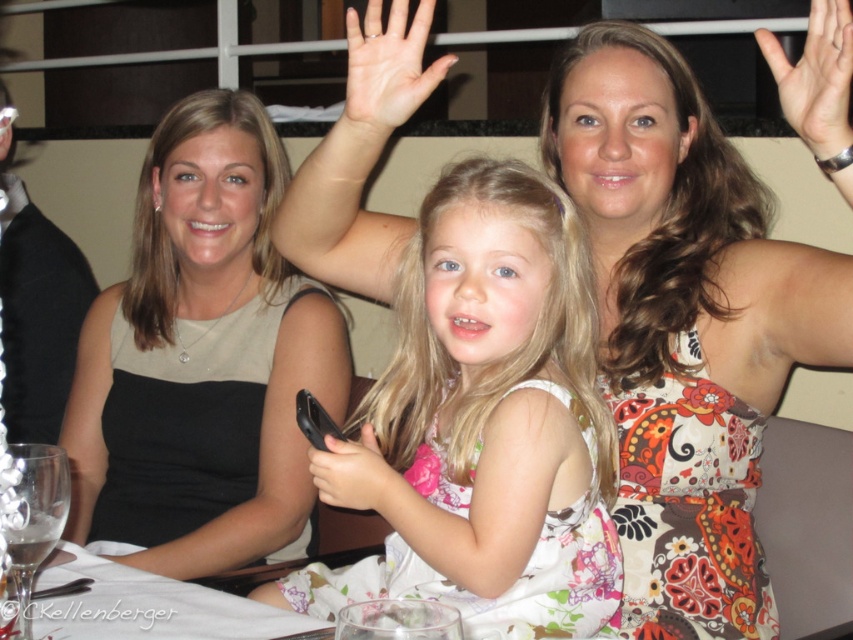
Is matte beige dress at left to the right of black matte phone at center from the viewer's perspective?

No, matte beige dress at left is not to the right of black matte phone at center.

This screenshot has width=853, height=640. In order to click on matte beige dress at left in this screenshot , I will do `click(202, 358)`.

Between point (274, 198) and point (323, 486), which one is positioned behind?

Point (274, 198)

What are the coordinates of `matte beige dress at left` in the screenshot? It's located at (202, 358).

Does black matte phone at center come in front of black plastic phone at center?

Yes.

Can you confirm if black matte phone at center is positioned to the left of black plastic phone at center?

Incorrect, black matte phone at center is not on the left side of black plastic phone at center.

Is point (325, 444) behind point (337, 433)?

No, (325, 444) is in front of (337, 433).

Identify the location of black matte phone at center. The image size is (853, 640). (352, 474).

Can you confirm if white floral dress at center is taller than matte beige dress at left?

No.

Is the position of white floral dress at center less distant than that of matte beige dress at left?

Yes.

Locate an element on the screen. The height and width of the screenshot is (640, 853). white floral dress at center is located at coordinates (490, 420).